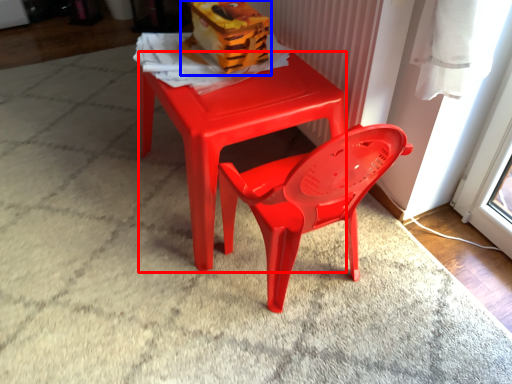
Question: Which object appears farthest to the camera in this image, table (highlighted by a red box) or toy (highlighted by a blue box)?

Choices:
 (A) table
 (B) toy

Answer: (B)